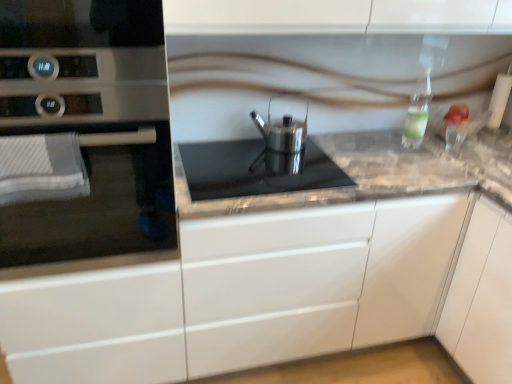
Measure the distance between satin silver kettle at center and camera.

satin silver kettle at center is 1.75 meters from camera.

The height and width of the screenshot is (384, 512). What do you see at coordinates (351, 255) in the screenshot? I see `marble gray counter at center` at bounding box center [351, 255].

This screenshot has width=512, height=384. What are the coordinates of `satin silver kettle at center` in the screenshot? It's located at (282, 130).

From the image's perspective, is clear glass bottle at upper right beneath marble gray counter at center?

No, from the image's perspective, clear glass bottle at upper right is not below marble gray counter at center.

From a real-world perspective, is clear glass bottle at upper right physically below marble gray counter at center?

Incorrect, from a real-world perspective, clear glass bottle at upper right is higher than marble gray counter at center.

Is clear glass bottle at upper right positioned with its back to marble gray counter at center?

No, clear glass bottle at upper right is not facing away from marble gray counter at center.

Would you say clear glass bottle at upper right is to the left or to the right of marble gray counter at center in the picture?

In the image, clear glass bottle at upper right appears on the right side of marble gray counter at center.

Who is taller, satin silver cookware at center or satin silver kettle at center?

satin silver kettle at center is taller.

Is satin silver cookware at center in contact with satin silver kettle at center?

No, satin silver cookware at center is not beside satin silver kettle at center.

From a real-world perspective, is satin silver cookware at center physically below satin silver kettle at center?

Correct, in the physical world, satin silver cookware at center is lower than satin silver kettle at center.

Relative to satin silver kettle at center, is satin silver cookware at center in front or behind?

Visually, satin silver cookware at center is located in front of satin silver kettle at center.

Can you see marble gray counter at center touching satin silver oven at left?

No, marble gray counter at center is not making contact with satin silver oven at left.

From the image's perspective, is marble gray counter at center above or below satin silver oven at left?

Clearly, from the image's perspective, marble gray counter at center is below satin silver oven at left.

In the scene shown: Is marble gray counter at center oriented towards satin silver oven at left?

No, marble gray counter at center is not aimed at satin silver oven at left.

Are marble gray counter at center and satin silver cookware at center beside each other?

There is a gap between marble gray counter at center and satin silver cookware at center.

Measure the distance from marble gray counter at center to satin silver cookware at center.

marble gray counter at center is 31.08 centimeters away from satin silver cookware at center.

Can you confirm if marble gray counter at center is positioned to the left of satin silver cookware at center?

In fact, marble gray counter at center is to the right of satin silver cookware at center.

Looking at this image, which of these two, marble gray counter at center or satin silver cookware at center, is thinner?

With smaller width is satin silver cookware at center.

Considering the relative positions of satin silver oven at left and satin silver cookware at center in the image provided, is satin silver oven at left to the left of satin silver cookware at center from the viewer's perspective?

Yes, satin silver oven at left is to the left of satin silver cookware at center.

How different are the orientations of satin silver oven at left and satin silver cookware at center in degrees?

satin silver oven at left and satin silver cookware at center are facing 0.327 degrees away from each other.

Is point (66, 244) less distant than point (331, 186)?

Yes, point (66, 244) is in front of point (331, 186).

Which of these two, satin silver oven at left or satin silver cookware at center, stands shorter?

With less height is satin silver cookware at center.

Would you say satin silver cookware at center is a long distance from clear glass bottle at upper right?

That's not correct — satin silver cookware at center is a little close to clear glass bottle at upper right.

How many degrees apart are the facing directions of satin silver cookware at center and clear glass bottle at upper right?

The facing directions of satin silver cookware at center and clear glass bottle at upper right are 2.26 degrees apart.

From a real-world perspective, is satin silver cookware at center over clear glass bottle at upper right?

Actually, satin silver cookware at center is physically below clear glass bottle at upper right in the real world.

Between satin silver cookware at center and clear glass bottle at upper right, which one has smaller size?

clear glass bottle at upper right.

Does point (204, 253) lie behind point (426, 103)?

No, it is not.

Can we say marble gray counter at center lies outside clear glass bottle at upper right?

That's correct, marble gray counter at center is outside of clear glass bottle at upper right.

Considering their positions, is marble gray counter at center located in front of or behind clear glass bottle at upper right?

Visually, marble gray counter at center is located in front of clear glass bottle at upper right.

The width and height of the screenshot is (512, 384). Identify the location of bottle above the marble gray counter at center (from the image's perspective). (417, 113).

Where is `gas stove in front of the satin silver kettle at center`? This screenshot has width=512, height=384. gas stove in front of the satin silver kettle at center is located at coordinates (255, 169).

Estimate the real-world distances between objects in this image. Which object is further from clear glass bottle at upper right, satin silver oven at left or marble gray counter at center?

Based on the image, satin silver oven at left appears to be further to clear glass bottle at upper right.

Based on their spatial positions, is clear glass bottle at upper right or marble gray counter at center further from satin silver oven at left?

Based on the image, clear glass bottle at upper right appears to be further to satin silver oven at left.

When comparing their distances from clear glass bottle at upper right, does satin silver kettle at center or satin silver oven at left seem closer?

The object closer to clear glass bottle at upper right is satin silver kettle at center.

From the image, which object appears to be farther from satin silver cookware at center, satin silver kettle at center or satin silver oven at left?

Among the two, satin silver oven at left is located further to satin silver cookware at center.

Which object lies further to the anchor point satin silver oven at left, satin silver cookware at center or satin silver kettle at center?

satin silver kettle at center is further to satin silver oven at left.

Estimate the real-world distances between objects in this image. Which object is further from satin silver cookware at center, satin silver oven at left or clear glass bottle at upper right?

Among the two, clear glass bottle at upper right is located further to satin silver cookware at center.

Estimate the real-world distances between objects in this image. Which object is closer to satin silver oven at left, satin silver cookware at center or clear glass bottle at upper right?

satin silver cookware at center is positioned closer to the anchor satin silver oven at left.

Based on their spatial positions, is satin silver cookware at center or satin silver oven at left further from satin silver kettle at center?

Based on the image, satin silver oven at left appears to be further to satin silver kettle at center.

Locate an element on the screen. The height and width of the screenshot is (384, 512). kitchen appliance located between satin silver oven at left and clear glass bottle at upper right in the left-right direction is located at coordinates (282, 130).

Where is `gas stove positioned between satin silver oven at left and satin silver kettle at center from near to far`? This screenshot has width=512, height=384. gas stove positioned between satin silver oven at left and satin silver kettle at center from near to far is located at coordinates (255, 169).

Find the location of a particular element. The height and width of the screenshot is (384, 512). gas stove between satin silver oven at left and marble gray counter at center from left to right is located at coordinates (255, 169).

Locate an element on the screen. kitchen appliance between clear glass bottle at upper right and marble gray counter at center from top to bottom is located at coordinates (282, 130).